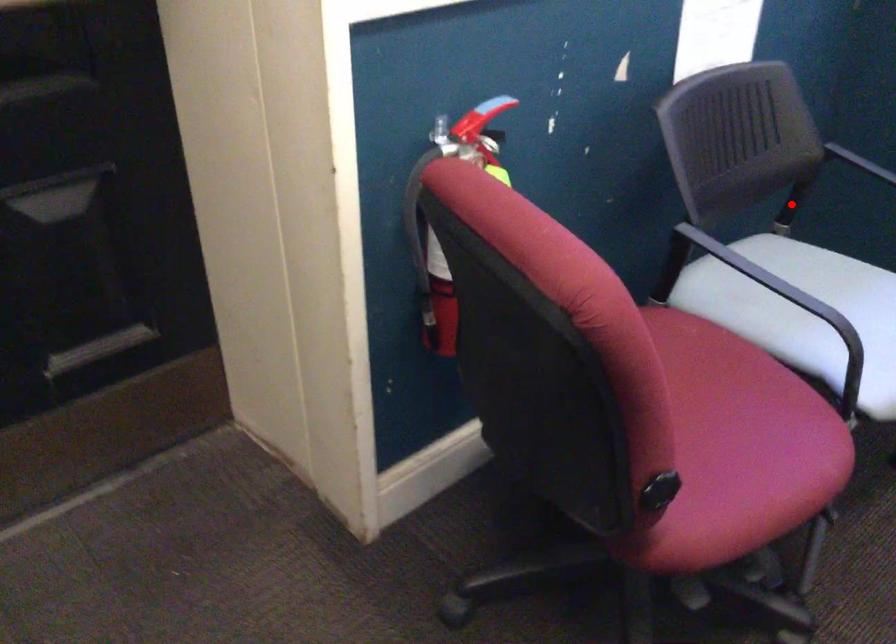
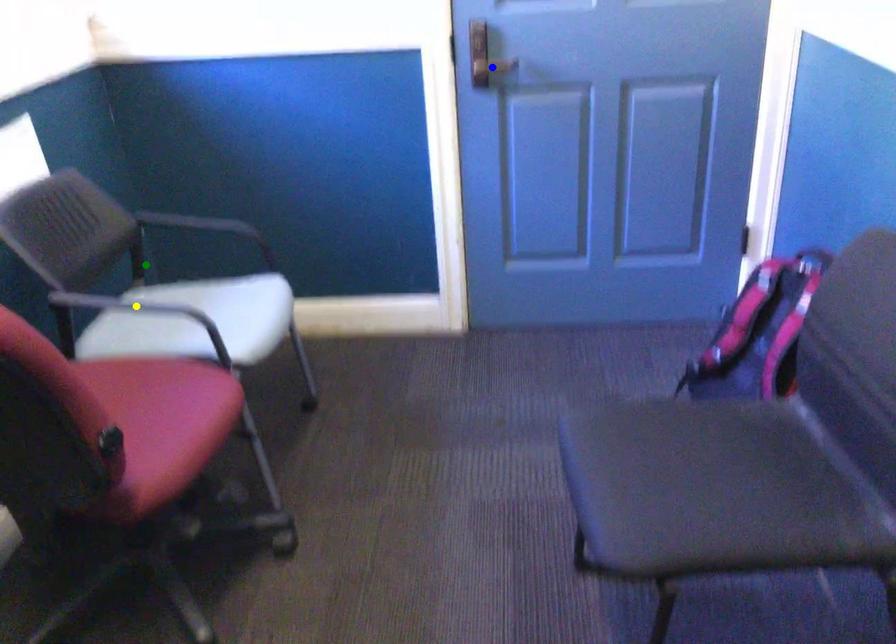
Question: I am providing you with two images of the same scene from different viewpoints. A red point is marked on the first image. You are given multiple points on the second image. Which mark in image 2 goes with the point in image 1?

Choices:
 (A) yellow point
 (B) blue point
 (C) green point

Answer: (C)